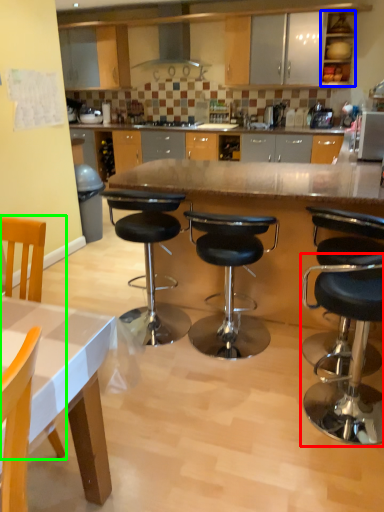
Question: Which object is the farthest from stool (highlighted by a red box)? Choose among these: cabinetry (highlighted by a blue box) or chair (highlighted by a green box).

Choices:
 (A) cabinetry
 (B) chair

Answer: (A)